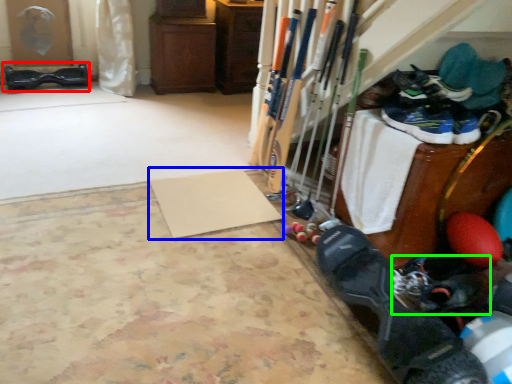
Question: Considering the real-world distances, which object is closest to footwear (highlighted by a red box)? yoga mat (highlighted by a blue box) or footwear (highlighted by a green box).

Choices:
 (A) yoga mat
 (B) footwear

Answer: (A)